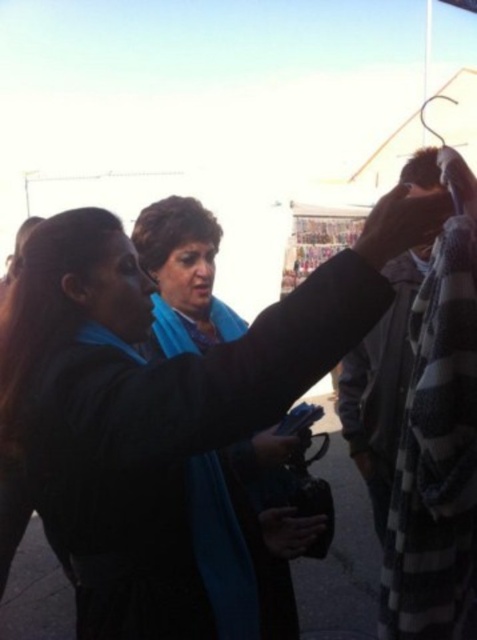
Is matte black jacket at upper center to the left of blue fabric scarf at center from the viewer's perspective?

Indeed, matte black jacket at upper center is positioned on the left side of blue fabric scarf at center.

Can you confirm if matte black jacket at upper center is smaller than blue fabric scarf at center?

Incorrect, matte black jacket at upper center is not smaller in size than blue fabric scarf at center.

Does point (132, 369) lie behind point (275, 529)?

That is False.

Locate an element on the screen. This screenshot has height=640, width=477. matte black jacket at upper center is located at coordinates (165, 401).